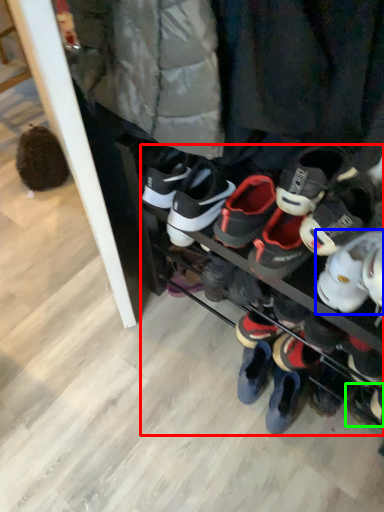
Question: Which is farther away from footwear (highlighted by a red box)? footwear (highlighted by a blue box) or footwear (highlighted by a green box)?

Choices:
 (A) footwear
 (B) footwear

Answer: (B)